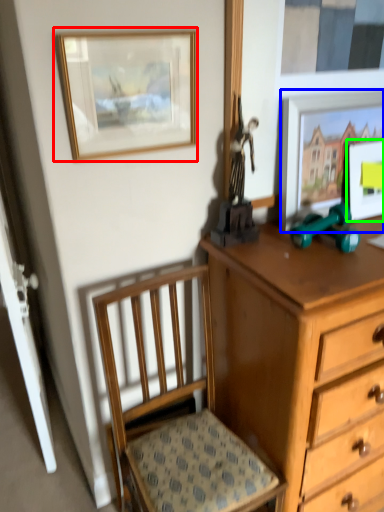
Question: Which object is the farthest from picture frame (highlighted by a red box)? Choose among these: picture frame (highlighted by a blue box) or picture frame (highlighted by a green box).

Choices:
 (A) picture frame
 (B) picture frame

Answer: (B)